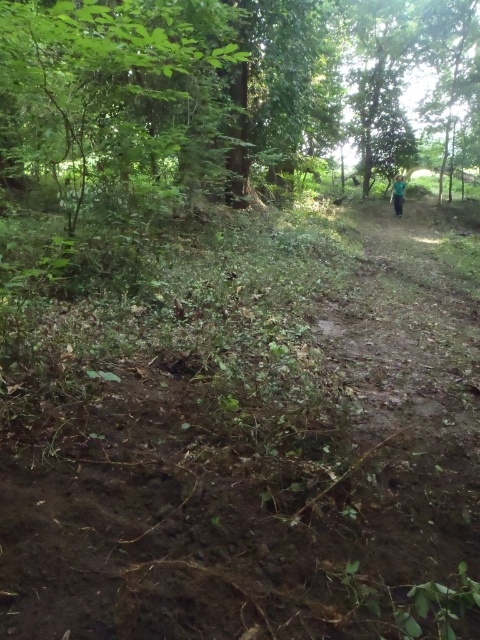
Which is below, brown dirt track at center or green fabric person at upper right?

brown dirt track at center

What are the coordinates of `brown dirt track at center` in the screenshot? It's located at (252, 440).

Image resolution: width=480 pixels, height=640 pixels. What do you see at coordinates (252, 440) in the screenshot?
I see `brown dirt track at center` at bounding box center [252, 440].

Image resolution: width=480 pixels, height=640 pixels. Find the location of `brown dirt track at center`. brown dirt track at center is located at coordinates (252, 440).